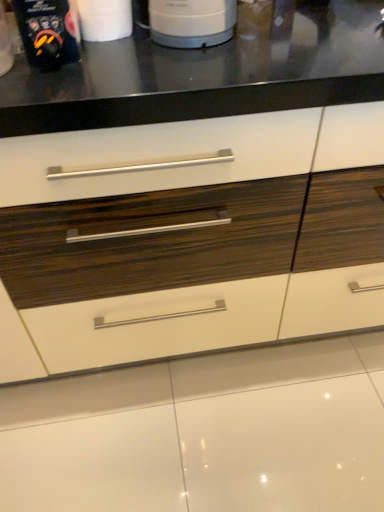
I want to click on unoccupied region to the right of matte black coffee maker at upper left, so click(x=154, y=64).